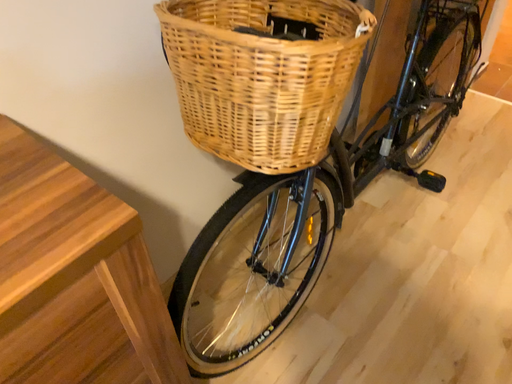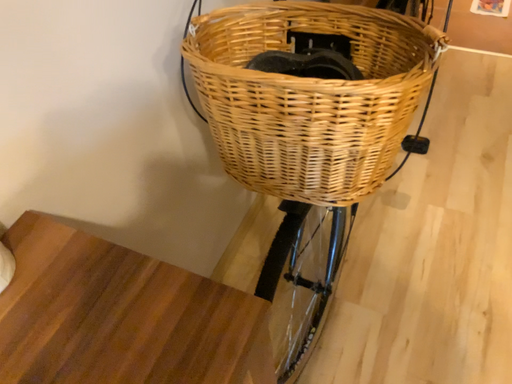
Question: How did the camera likely rotate when shooting the video?

Choices:
 (A) rotated left
 (B) rotated right

Answer: (B)